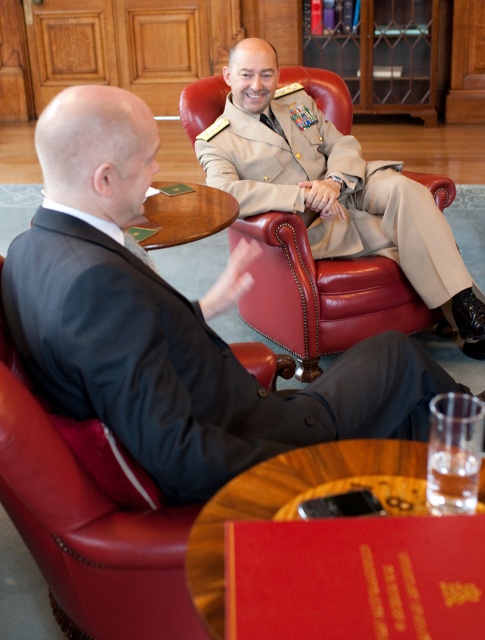
In the scene shown: You are standing at the entrance of the room and want to hand a document to the person in the khaki uniform at center. The wooden round table at center is blocking your path. Can you walk around the table to reach the person?

The khaki uniform at center is to the left of wooden round table at center, so you can walk around the right side of the wooden round table at center to reach the khaki uniform at center.

You are a photographer setting up for a group photo. You need to ensure that both the leather armchair at center and the wooden round table at center are visible in the frame. Given their height difference, which object will appear larger in the photo?

The leather armchair at center will appear larger in the photo because it is much taller than the wooden round table at center.